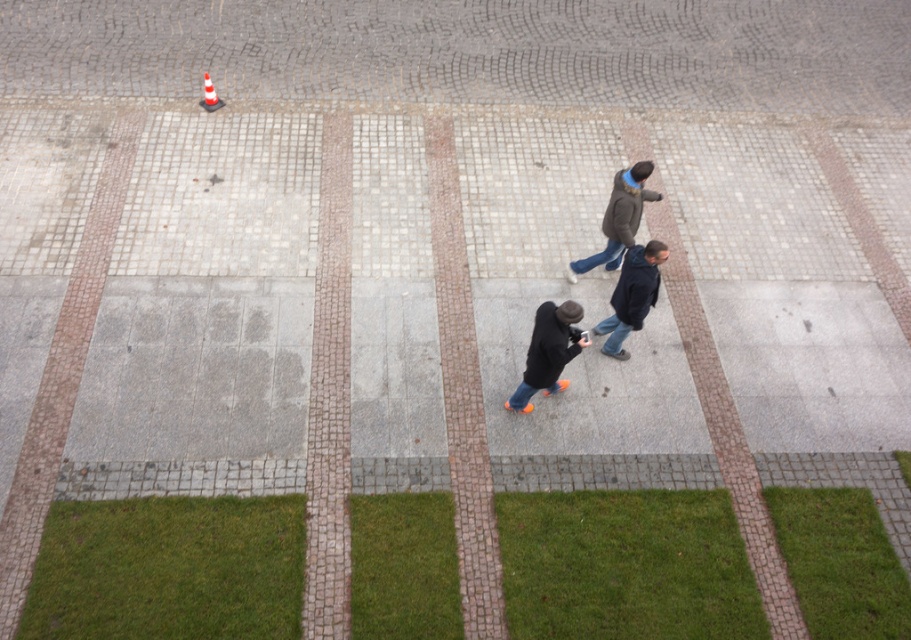
You are a delivery person who needs to deliver a package to the orange and white striped traffic cone at upper left. You are currently standing at the orange suede shoes at center. Which direction should you move to reach the traffic cone?

The orange suede shoes at center is bigger than orange and white striped traffic cone at upper left, but this detail does not affect direction. Since the traffic cone is at the upper left, you should move towards the upper left direction from the orange suede shoes at center to reach it.

You are designing a seating arrangement for a small event in the paved area shown. You need to place two chairs next to the dark blue jacket at center and dark brown jacket at center. Which jacket requires a wider chair to accommodate its width?

The dark brown jacket at center requires a wider chair because its width is greater than the dark blue jacket at center.